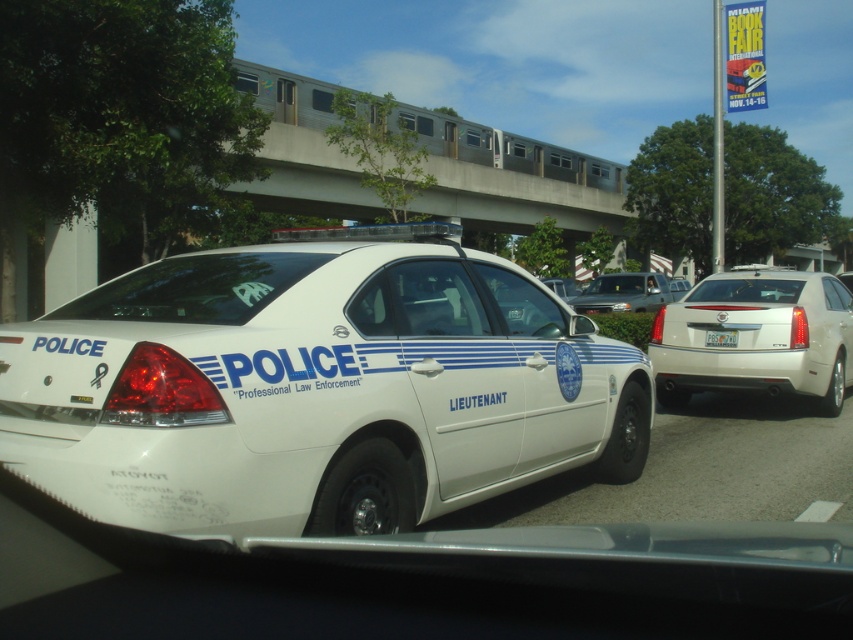
Question: Which point is farther from the camera taking this photo?

Choices:
 (A) (752, 356)
 (B) (718, 339)
 (C) (608, 282)
 (D) (196, 496)

Answer: (C)

Question: Is white glossy police car at center below metallic silver suv at center?

Choices:
 (A) yes
 (B) no

Answer: (A)

Question: Based on their relative distances, which object is farther from the white glossy sedan at center?

Choices:
 (A) metallic silver suv at center
 (B) white glossy police car at center
 (C) white plastic license plate at center

Answer: (A)

Question: In this image, where is white glossy police car at center located relative to white glossy sedan at center?

Choices:
 (A) left
 (B) right

Answer: (A)

Question: Considering the real-world distances, which object is farthest from the metallic silver suv at center?

Choices:
 (A) white glossy sedan at center
 (B) white plastic license plate at center
 (C) white glossy police car at center

Answer: (C)

Question: Is white glossy police car at center to the right of metallic silver suv at center from the viewer's perspective?

Choices:
 (A) no
 (B) yes

Answer: (A)